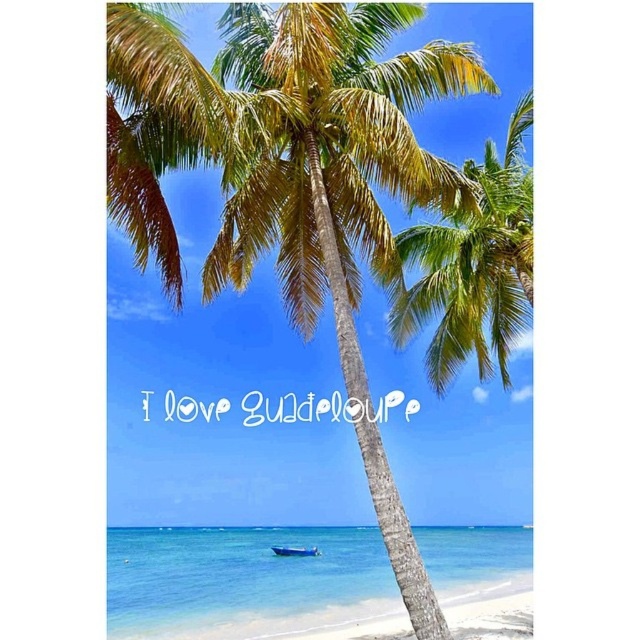
Question: Can you confirm if green leafy coconut tree at center is positioned above blue plastic boat at lower center?

Choices:
 (A) no
 (B) yes

Answer: (B)

Question: Which of the following is the farthest from the observer?

Choices:
 (A) blue plastic boat at lower center
 (B) green leafy coconut tree at center

Answer: (A)

Question: Which point appears closest to the camera in this image?

Choices:
 (A) (522, 336)
 (B) (285, 556)

Answer: (A)

Question: Among these objects, which one is nearest to the camera?

Choices:
 (A) green leafy coconut tree at center
 (B) blue plastic boat at lower center

Answer: (A)

Question: Does green leafy coconut tree at center appear on the left side of blue plastic boat at lower center?

Choices:
 (A) yes
 (B) no

Answer: (B)

Question: Can you confirm if green leafy coconut tree at center is positioned to the right of blue plastic boat at lower center?

Choices:
 (A) no
 (B) yes

Answer: (B)